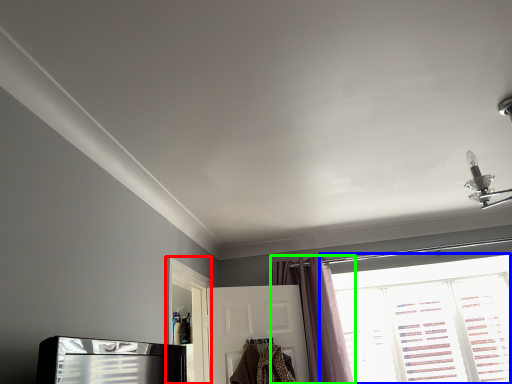
Question: Estimate the real-world distances between objects in this image. Which object is farther from screen door (highlighted by a red box), window (highlighted by a blue box) or curtain (highlighted by a green box)?

Choices:
 (A) window
 (B) curtain

Answer: (A)